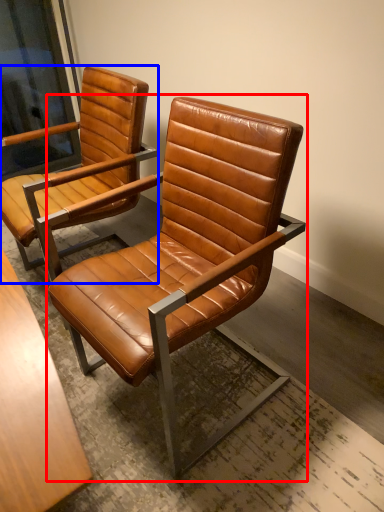
Question: Which object appears farthest to the camera in this image, chair (highlighted by a red box) or chair (highlighted by a blue box)?

Choices:
 (A) chair
 (B) chair

Answer: (B)